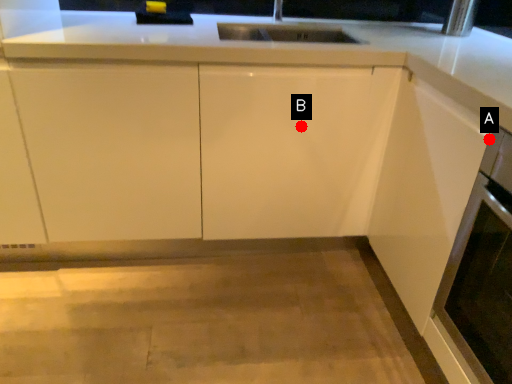
Question: Two points are circled on the image, labeled by A and B beside each circle. Which point appears closest to the camera in this image?

Choices:
 (A) A is closer
 (B) B is closer

Answer: (A)